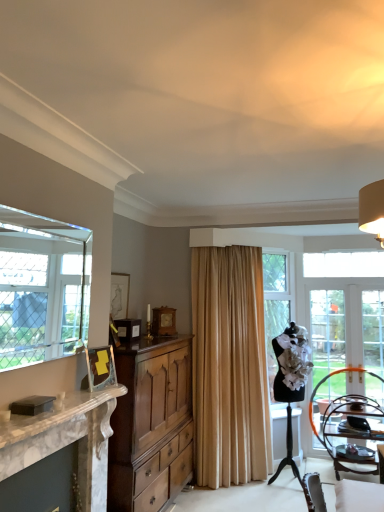
Image resolution: width=384 pixels, height=512 pixels. I want to click on clear glass window at left, so click(42, 287).

Where is `beige fabric curtain at center`? The width and height of the screenshot is (384, 512). beige fabric curtain at center is located at coordinates (229, 367).

The height and width of the screenshot is (512, 384). What are the coordinates of `clear glass door at right` in the screenshot? It's located at (346, 330).

From the image's perspective, is clear glass door at right beneath wooden cabinet at center-left?

No, from the image's perspective, clear glass door at right is not below wooden cabinet at center-left.

From a real-world perspective, who is located lower, clear glass door at right or wooden cabinet at center-left?

In real-world perspective, wooden cabinet at center-left is lower.

Consider the image. Would you say clear glass door at right is outside wooden cabinet at center-left?

clear glass door at right is positioned outside wooden cabinet at center-left.

Choose the correct answer: Is wooden chair at lower right inside beige fabric curtain at center or outside it?

wooden chair at lower right is located beyond the bounds of beige fabric curtain at center.

The width and height of the screenshot is (384, 512). I want to click on curtain that appears in front of the wooden chair at lower right, so click(x=229, y=367).

Which is more to the left, wooden chair at lower right or beige fabric curtain at center?

beige fabric curtain at center is more to the left.

Can you confirm if wooden chair at lower right is bigger than beige fabric curtain at center?

No, wooden chair at lower right is not bigger than beige fabric curtain at center.

Based on their positions, is wooden cabinet at center-left located to the left or right of clear glass window at left?

From the image, it's evident that wooden cabinet at center-left is to the right of clear glass window at left.

Considering the sizes of objects wooden cabinet at center-left and clear glass window at left in the image provided, who is smaller, wooden cabinet at center-left or clear glass window at left?

With smaller size is clear glass window at left.

Consider the image. How different are the orientations of wooden cabinet at center-left and clear glass window at left in degrees?

wooden cabinet at center-left and clear glass window at left are facing 0.337 degrees away from each other.

Locate an element on the screen. This screenshot has width=384, height=512. cabinetry on the right side of clear glass window at left is located at coordinates (148, 415).

In the scene shown: Which object is thinner, wooden cabinet at center-left or wooden chair at lower right?

Thinner between the two is wooden chair at lower right.

Which of these two, wooden cabinet at center-left or wooden chair at lower right, stands taller?

wooden cabinet at center-left.

Where is `chair that is under the wooden cabinet at center-left (from a real-world perspective)`? The image size is (384, 512). chair that is under the wooden cabinet at center-left (from a real-world perspective) is located at coordinates (349, 426).

Would you say wooden cabinet at center-left is outside wooden chair at lower right?

Yes, wooden cabinet at center-left is located beyond the bounds of wooden chair at lower right.

In the image, there is a clear glass door at right. At what (x,y) coordinates should I click in order to perform the action: click on window above it (from the image's perspective). Please return your answer as a coordinate pair (x, y). The width and height of the screenshot is (384, 512). Looking at the image, I should click on coord(42,287).

Is clear glass window at left in contact with clear glass door at right?

No, clear glass window at left is not in contact with clear glass door at right.

Is clear glass window at left aimed at clear glass door at right?

No.

Is clear glass window at left shorter than clear glass door at right?

Yes, clear glass window at left is shorter than clear glass door at right.

From the image's perspective, is clear glass door at right over wooden chair at lower right?

Correct, clear glass door at right appears higher than wooden chair at lower right in the image.

Which is more to the left, clear glass door at right or wooden chair at lower right?

wooden chair at lower right.

Is clear glass door at right wider or thinner than wooden chair at lower right?

Considering their sizes, clear glass door at right looks slimmer than wooden chair at lower right.

Is clear glass door at right with wooden chair at lower right?

clear glass door at right and wooden chair at lower right are not in contact.

Does wooden cabinet at center-left appear on the right side of beige fabric curtain at center?

No.

Based on their sizes in the image, would you say wooden cabinet at center-left is bigger or smaller than beige fabric curtain at center?

In the image, wooden cabinet at center-left appears to be larger than beige fabric curtain at center.

From the image's perspective, does wooden cabinet at center-left appear lower than beige fabric curtain at center?

Yes, from the image's perspective, wooden cabinet at center-left is beneath beige fabric curtain at center.

I want to click on cabinetry in front of the clear glass door at right, so click(x=148, y=415).

Locate an element on the screen. The image size is (384, 512). chair that appears on the right of beige fabric curtain at center is located at coordinates (349, 426).

Estimate the real-world distances between objects in this image. Which object is further from beige fabric curtain at center, white marble fireplace at left or clear glass door at right?

white marble fireplace at left lies further to beige fabric curtain at center than the other object.

Estimate the real-world distances between objects in this image. Which object is closer to clear glass window at left, wooden chair at lower right or wooden cabinet at center-left?

wooden cabinet at center-left is positioned closer to the anchor clear glass window at left.

Based on their spatial positions, is wooden cabinet at center-left or clear glass door at right further from clear glass window at left?

clear glass door at right lies further to clear glass window at left than the other object.

From the image, which object appears to be farther from wooden chair at lower right, wooden cabinet at center-left or clear glass window at left?

clear glass window at left is positioned further to the anchor wooden chair at lower right.

From the image, which object appears to be farther from white marble fireplace at left, wooden chair at lower right or beige fabric curtain at center?

wooden chair at lower right is positioned further to the anchor white marble fireplace at left.

From the picture: Which object lies further to the anchor point wooden cabinet at center-left, wooden chair at lower right or clear glass window at left?

wooden chair at lower right lies further to wooden cabinet at center-left than the other object.

Estimate the real-world distances between objects in this image. Which object is closer to wooden cabinet at center-left, wooden chair at lower right or white marble fireplace at left?

white marble fireplace at left is closer to wooden cabinet at center-left.

Considering their positions, is clear glass door at right positioned further to beige fabric curtain at center than wooden cabinet at center-left?

The object further to beige fabric curtain at center is clear glass door at right.

Identify the location of curtain between clear glass window at left and clear glass door at right in the front-back direction. (229, 367).

I want to click on cabinetry positioned between clear glass window at left and beige fabric curtain at center from near to far, so pyautogui.click(x=148, y=415).

Find the location of a particular element. curtain between wooden cabinet at center-left and clear glass door at right in the horizontal direction is located at coordinates (229, 367).

Find the location of a particular element. The width and height of the screenshot is (384, 512). desk located between clear glass window at left and wooden chair at lower right in the left-right direction is located at coordinates (66, 440).